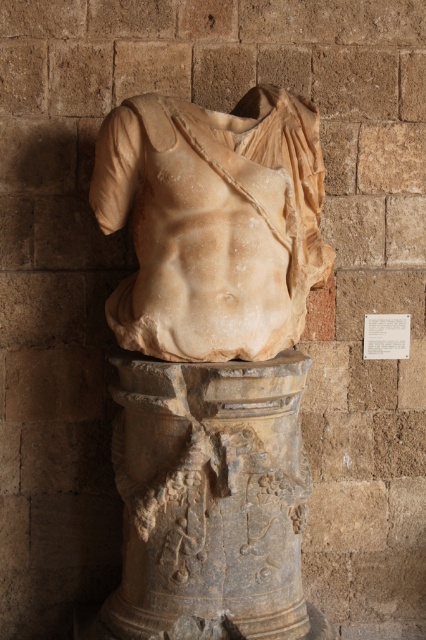
You are a GUI agent. You are given a task and a screenshot of the screen. Output one action in this format:
    pyautogui.click(x=<x>, y=<y>)
    Task: Click on the marble statue at center
    
    Given the screenshot: What is the action you would take?
    pyautogui.click(x=212, y=362)

Between marble statue at center and marble statue torso at center, which one appears on the right side from the viewer's perspective?

marble statue torso at center

Does point (296, 464) come behind point (259, 257)?

Yes.

Where is `marble statue at center`? The image size is (426, 640). marble statue at center is located at coordinates pos(212,362).

Can you confirm if marble statue at center is wider than gray stone pedestal at center?

Yes.

Between marble statue at center and gray stone pedestal at center, which one appears on the left side from the viewer's perspective?

gray stone pedestal at center

Identify the location of marble statue at center. The height and width of the screenshot is (640, 426). (212, 362).

Does marble statue torso at center appear under gray stone pedestal at center?

No.

Is marble statue torso at center shorter than gray stone pedestal at center?

No, marble statue torso at center is not shorter than gray stone pedestal at center.

Locate an element on the screen. The width and height of the screenshot is (426, 640). marble statue torso at center is located at coordinates (213, 221).